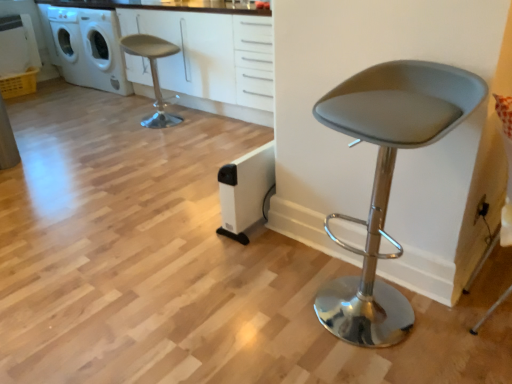
Question: Is white matte cabinet at upper center positioned with its back to white plastic washing machine at upper left?

Choices:
 (A) no
 (B) yes

Answer: (A)

Question: Is the depth of white matte cabinet at upper center greater than that of white plastic washing machine at upper left?

Choices:
 (A) no
 (B) yes

Answer: (A)

Question: Is white matte cabinet at upper center at the left side of white plastic washing machine at upper left?

Choices:
 (A) yes
 (B) no

Answer: (B)

Question: Is white plastic washing machine at upper left completely or partially inside white matte cabinet at upper center?

Choices:
 (A) no
 (B) yes

Answer: (A)

Question: From a real-world perspective, is white matte cabinet at upper center on top of white plastic washing machine at upper left?

Choices:
 (A) yes
 (B) no

Answer: (A)

Question: Considering the relative sizes of white matte cabinet at upper center and white plastic washing machine at upper left in the image provided, is white matte cabinet at upper center shorter than white plastic washing machine at upper left?

Choices:
 (A) no
 (B) yes

Answer: (B)

Question: Could you tell me if white plastic washing machine at upper left is facing matte gray stool at center, positioned as the second chair in top-to-bottom order?

Choices:
 (A) yes
 (B) no

Answer: (B)

Question: Can we say white plastic washing machine at upper left lies outside matte gray stool at center, positioned as the 1th chair in front-to-back order?

Choices:
 (A) no
 (B) yes

Answer: (B)

Question: Does white plastic washing machine at upper left have a larger size compared to matte gray stool at center, placed as the first chair when sorted from right to left?

Choices:
 (A) yes
 (B) no

Answer: (A)

Question: Considering the relative sizes of white plastic washing machine at upper left and matte gray stool at center, positioned as the 1th chair in front-to-back order, in the image provided, is white plastic washing machine at upper left thinner than matte gray stool at center, positioned as the 1th chair in front-to-back order,?

Choices:
 (A) yes
 (B) no

Answer: (B)

Question: Does white plastic washing machine at upper left have a greater height compared to matte gray stool at center, the second chair viewed from the left?

Choices:
 (A) no
 (B) yes

Answer: (B)

Question: Can you confirm if white plastic washing machine at upper left is smaller than matte gray stool at center, positioned as the 1th chair in front-to-back order?

Choices:
 (A) yes
 (B) no

Answer: (B)

Question: Can you confirm if matte gray stool at upper left, arranged as the 1th chair when viewed from the left, is thinner than white plastic washing machine at upper left?

Choices:
 (A) yes
 (B) no

Answer: (A)